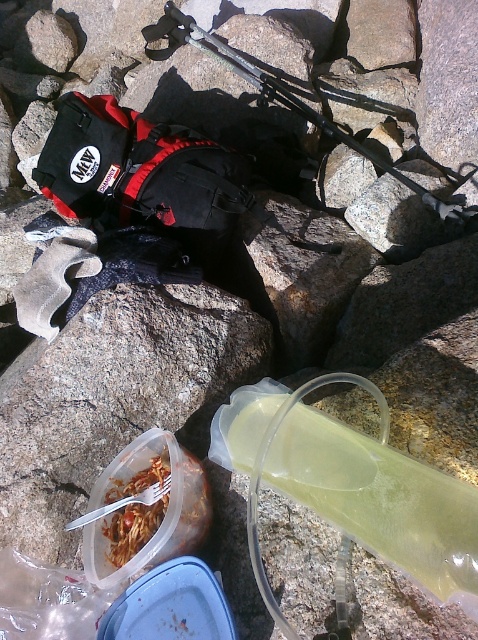
Does translucent plastic bottle at lower center have a greater height compared to black nylon trekking pole at center?

In fact, translucent plastic bottle at lower center may be shorter than black nylon trekking pole at center.

Is translucent plastic bottle at lower center to the left of black nylon trekking pole at center from the viewer's perspective?

Indeed, translucent plastic bottle at lower center is positioned on the left side of black nylon trekking pole at center.

This screenshot has width=478, height=640. Describe the element at coordinates (350, 486) in the screenshot. I see `translucent plastic bottle at lower center` at that location.

I want to click on translucent plastic bottle at lower center, so click(350, 486).

What do you see at coordinates (350, 486) in the screenshot?
I see `translucent plastic bottle at lower center` at bounding box center [350, 486].

Locate an element on the screen. translucent plastic bottle at lower center is located at coordinates (350, 486).

The width and height of the screenshot is (478, 640). Describe the element at coordinates (274, 93) in the screenshot. I see `black nylon trekking pole at center` at that location.

Based on the photo, who is more distant from viewer, (x=430, y=204) or (x=152, y=481)?

The point (x=430, y=204) is behind.

Is point (217, 56) positioned before point (121, 496)?

No, (217, 56) is behind (121, 496).

Locate an element on the screen. The image size is (478, 640). black nylon trekking pole at center is located at coordinates (274, 93).